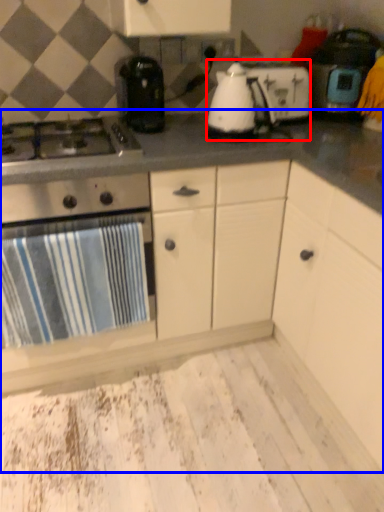
Question: Which object is further to the camera taking this photo, kitchen appliance (highlighted by a red box) or countertop (highlighted by a blue box)?

Choices:
 (A) kitchen appliance
 (B) countertop

Answer: (A)